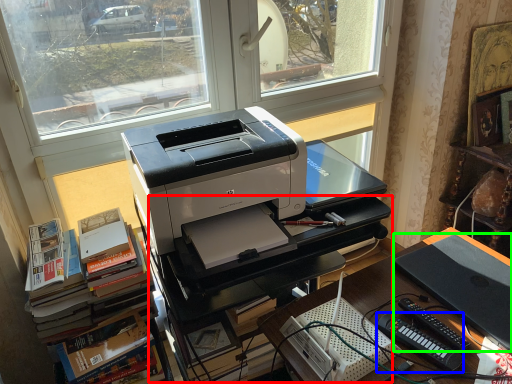
Question: Based on their relative distances, which object is farther from computer desk (highlighted by a red box)? Choose from equipment (highlighted by a blue box) and computer (highlighted by a green box).

Choices:
 (A) equipment
 (B) computer

Answer: (A)